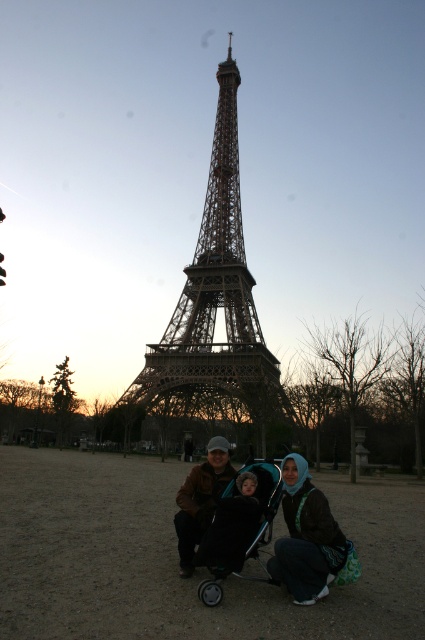
Who is positioned more to the left, metallic structure at center or green fabric hijab at center?

metallic structure at center

Which of these two, metallic structure at center or green fabric hijab at center, stands taller?

metallic structure at center

Who is more distant from viewer, (x=209, y=388) or (x=343, y=563)?

Positioned behind is point (x=209, y=388).

At what (x,y) coordinates should I click in order to perform the action: click on metallic structure at center. Please return your answer as a coordinate pair (x, y). Looking at the image, I should click on (215, 300).

Between point (325, 564) and point (218, 513), which one is positioned in front?

Point (325, 564) is in front.

The image size is (425, 640). Find the location of `green fabric hijab at center`. green fabric hijab at center is located at coordinates (306, 536).

Does point (226, 145) come in front of point (218, 474)?

No.

Based on the photo, which is more to the right, metallic structure at center or brown leather jacket at center?

Positioned to the right is metallic structure at center.

Which is in front, point (255, 356) or point (201, 508)?

Point (255, 356) is more forward.

Locate an element on the screen. This screenshot has width=425, height=640. metallic structure at center is located at coordinates (215, 300).